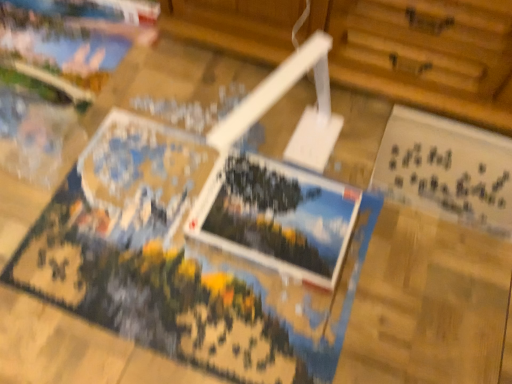
Question: Can you confirm if white paper postcard at lower right, the 1th postcard in the right-to-left sequence, is smaller than printed paper postcard at center, positioned as the first postcard in left-to-right order?

Choices:
 (A) yes
 (B) no

Answer: (B)

Question: From the image's perspective, is white paper postcard at lower right, the 2th postcard from the left, below printed paper postcard at center, which ranks as the 2th postcard in right-to-left order?

Choices:
 (A) yes
 (B) no

Answer: (B)

Question: Is white paper postcard at lower right, the 2th postcard from the left, positioned beyond the bounds of printed paper postcard at center, positioned as the first postcard in left-to-right order?

Choices:
 (A) yes
 (B) no

Answer: (A)

Question: From a real-world perspective, is white paper postcard at lower right, the 2th postcard from the left, under printed paper postcard at center, which ranks as the 2th postcard in right-to-left order?

Choices:
 (A) no
 (B) yes

Answer: (B)

Question: Can printed paper postcard at center, positioned as the first postcard in left-to-right order, be found inside white paper postcard at lower right, the 2th postcard from the left?

Choices:
 (A) no
 (B) yes

Answer: (A)

Question: Can you confirm if white paper postcard at lower right, the 1th postcard in the right-to-left sequence, is shorter than printed paper postcard at center, positioned as the first postcard in left-to-right order?

Choices:
 (A) yes
 (B) no

Answer: (B)

Question: Is printed paper postcard at center, positioned as the first postcard in left-to-right order, at the right side of white paper postcard at lower right, the 2th postcard from the left?

Choices:
 (A) yes
 (B) no

Answer: (B)

Question: Is printed paper postcard at center, which ranks as the 2th postcard in right-to-left order, bigger than white paper postcard at lower right, the 1th postcard in the right-to-left sequence?

Choices:
 (A) no
 (B) yes

Answer: (A)

Question: Are printed paper postcard at center, positioned as the first postcard in left-to-right order, and white paper postcard at lower right, the 2th postcard from the left, making contact?

Choices:
 (A) no
 (B) yes

Answer: (A)

Question: Is printed paper postcard at center, positioned as the first postcard in left-to-right order, aimed at white paper postcard at lower right, the 1th postcard in the right-to-left sequence?

Choices:
 (A) no
 (B) yes

Answer: (A)

Question: Is printed paper postcard at center, which ranks as the 2th postcard in right-to-left order, to the left of white paper postcard at lower right, the 1th postcard in the right-to-left sequence, from the viewer's perspective?

Choices:
 (A) no
 (B) yes

Answer: (B)

Question: From the image's perspective, does printed paper postcard at center, positioned as the first postcard in left-to-right order, appear lower than white paper postcard at lower right, the 1th postcard in the right-to-left sequence?

Choices:
 (A) yes
 (B) no

Answer: (A)

Question: Which is correct: white paper postcard at lower right, the 2th postcard from the left, is inside printed paper postcard at center, positioned as the first postcard in left-to-right order, or outside of it?

Choices:
 (A) outside
 (B) inside

Answer: (A)